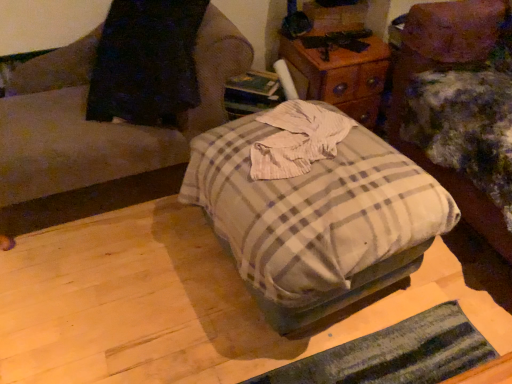
Where is `free location above plaid fabric ottoman at center (from a real-world perspective)`? free location above plaid fabric ottoman at center (from a real-world perspective) is located at coordinates (298, 148).